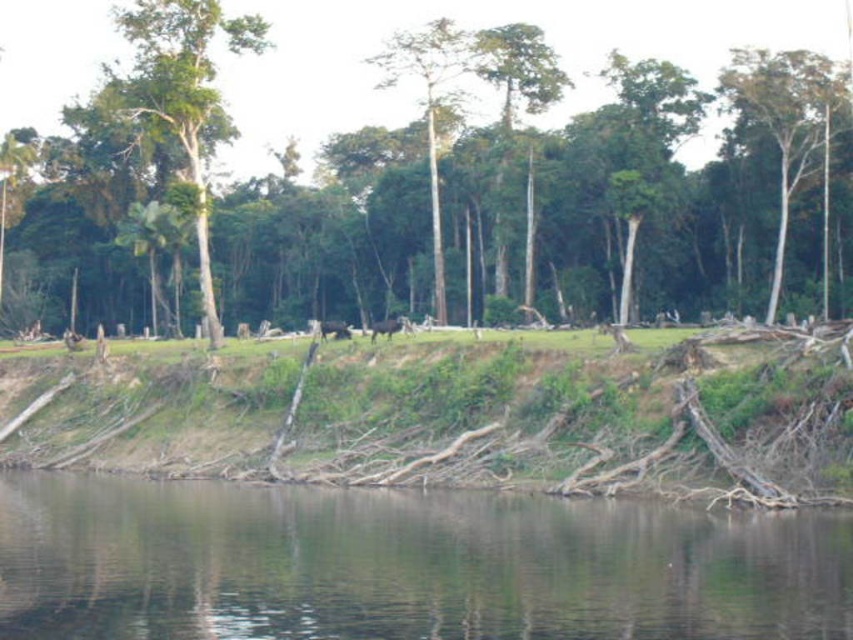
You are a hiker trying to navigate through the riverbank and need to locate two specific trees. You see the white smooth tree at upper right and the smooth bark tree at center. Which tree is positioned more to the east if the image is oriented with the river flowing from the north to the south?

The white smooth tree at upper right is positioned more to the east because it is to the right of the smooth bark tree at center, and since the river flows from north to south, the right side of the image corresponds to the eastern direction.

You are a hiker who wants to take a photo of both the white smooth tree at upper right and the smooth bark tree at center. Since you have a wide angle lens, you need to know which tree is bigger to frame the photo properly. Which tree is larger?

The white smooth tree at upper right is larger in size than the smooth bark tree at center, so you should frame the photo to accommodate its larger size.

You are a hiker trying to cross the river. You see the brown dirt river bank at center and the smooth bark tree at center. Which one is lower in height?

The brown dirt river bank at center has a lesser height compared to the smooth bark tree at center, so the brown dirt river bank at center is lower in height.